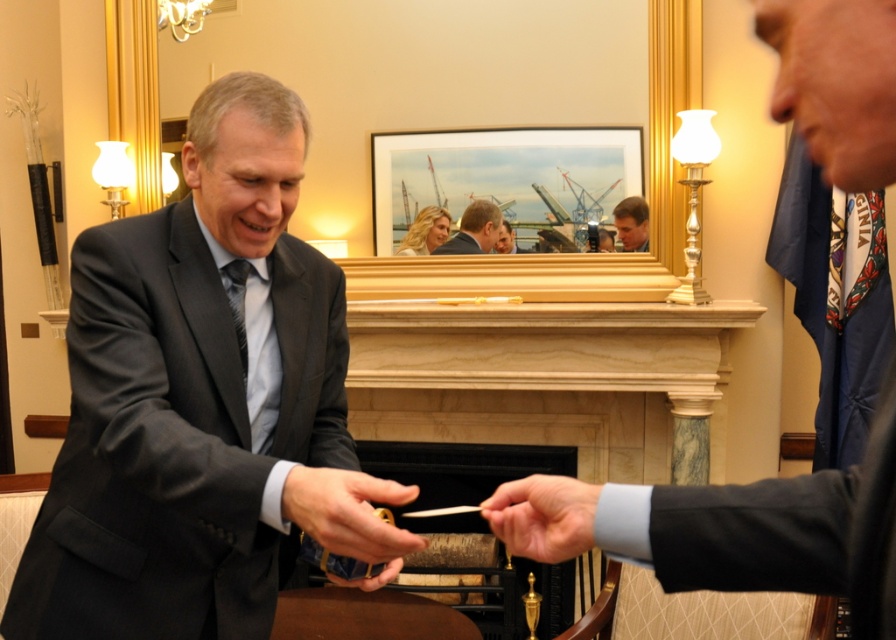
You are an observer standing in the room. You see the matte black hand at center and the smooth skin face at center. Which object is nearer to you?

The matte black hand at center is closer to the viewer than the smooth skin face at center.

You are attending a formal event and need to choose between two suits displayed in the image. The dark blue suit at right and the matte black suit at center. Based on the scene description, which suit is more appropriate for a ceremonial exchange?

The dark blue suit at right is more appropriate for a ceremonial exchange as it has a larger size compared to the matte black suit at center, suggesting it might be the one used in formal ceremonies.